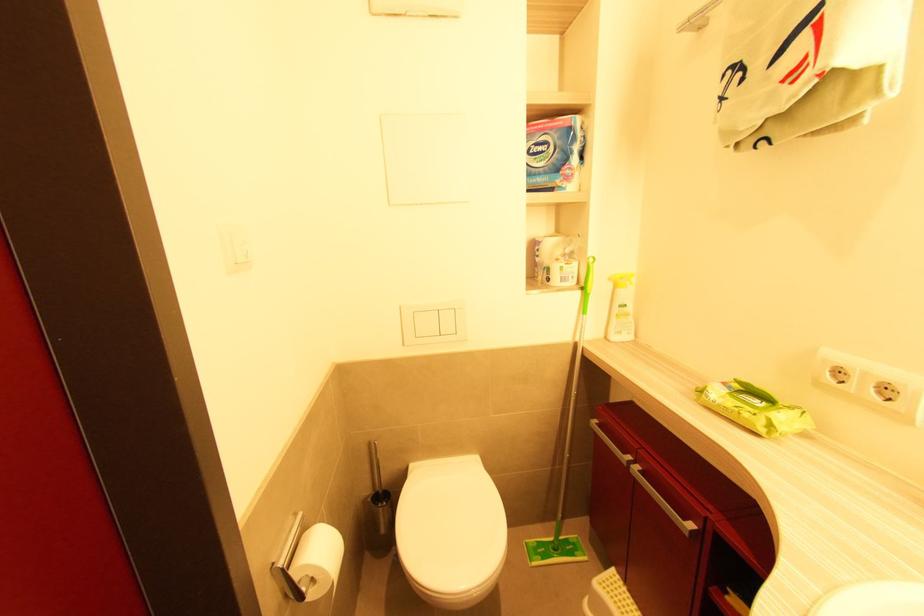
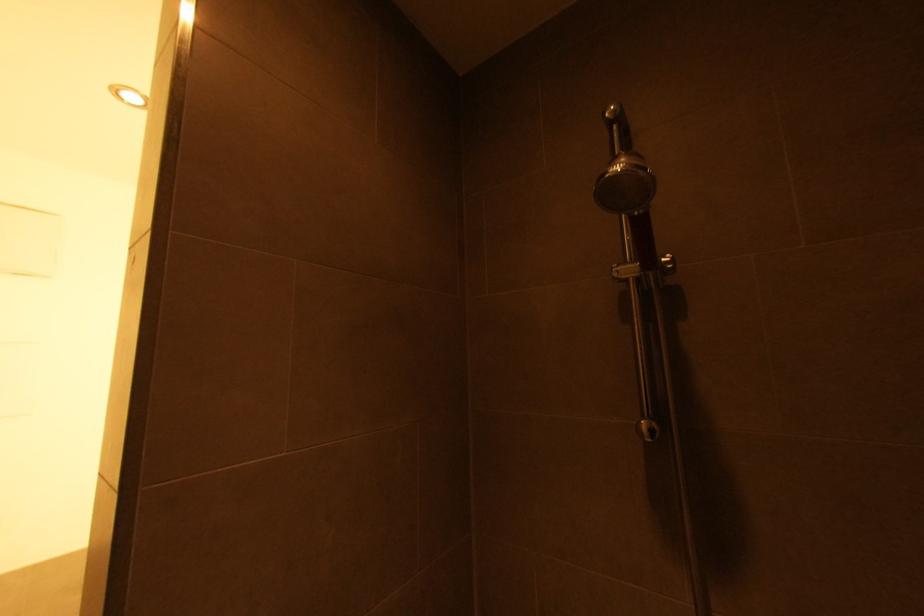
The images are taken continuously from a first-person perspective. In which direction is your viewpoint rotating?

The camera rotated toward right-up.